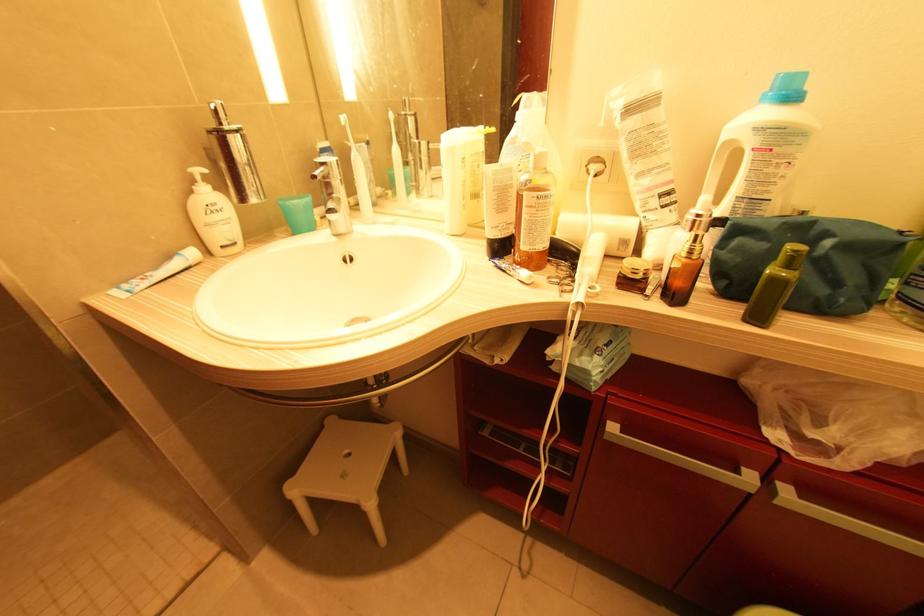
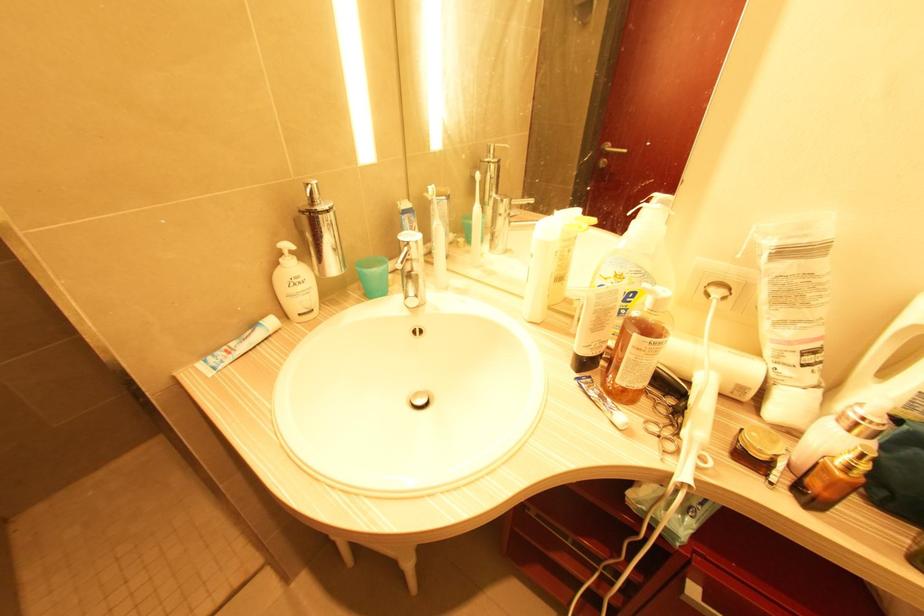
The point at [238,132] is marked in the first image. Where is the corresponding point in the second image?

(329, 212)